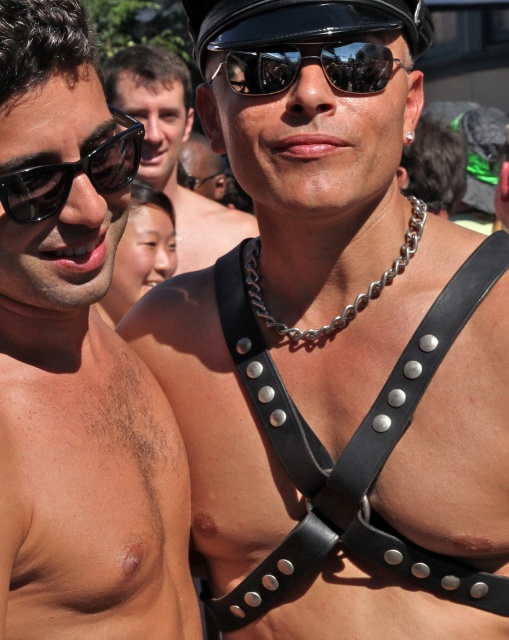
You are a photographer at the event and want to capture a closeup of the sunglasses. Which sunglasses, the matte black sunglasses at left or the black reflective sunglasses at center, would you need to adjust your camera settings for due to their reflective properties?

The black reflective sunglasses at center would require adjusting camera settings because they are more reflective than the matte black sunglasses at left.

You are holding a camera and want to take a closeup shot of the person on the right. The camera is currently focused on the point at point (6, 304) which is 8.31 feet away. Can you get closer to the person on the right to take the photo without moving the camera?

The point at point (6, 304) is 8.31 feet from the camera. Since the camera is focused on this point, moving closer would require adjusting the focus, so you cannot get closer without moving the camera.

You are a photographer at the event and want to capture a closeup of the person on the left. Which sunglasses are closer to the left edge of the frame between the matte black sunglasses at left and the black plastic sunglasses at left?

The matte black sunglasses at left are closer to the left edge of the frame because they are positioned on the left side of the black plastic sunglasses at left.